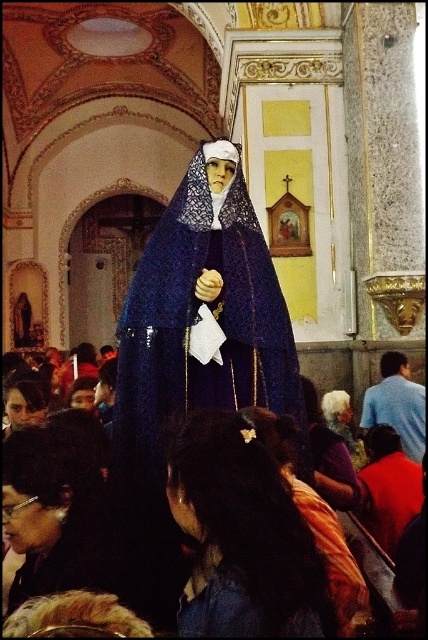
Question: Which object appears farthest from the camera in this image?

Choices:
 (A) white fabric headscarf at center
 (B) dark brown hair at center
 (C) gray hair at center
 (D) blue shirt at right

Answer: (C)

Question: Does blue shirt at right have a greater width compared to matte black hair at lower left?

Choices:
 (A) yes
 (B) no

Answer: (B)

Question: Among these points, which one is nearest to the camera?

Choices:
 (A) (419, 449)
 (B) (341, 477)
 (C) (362, 515)
 (D) (261, 570)

Answer: (D)

Question: Is white fabric headscarf at center further to the viewer compared to gray hair at center?

Choices:
 (A) no
 (B) yes

Answer: (A)

Question: Does dark brown hair at center lie behind blue shirt at right?

Choices:
 (A) yes
 (B) no

Answer: (B)

Question: Which point is closer to the camera taking this photo?

Choices:
 (A) (359, 467)
 (B) (341, 493)
 (C) (250, 580)
 (D) (422, 408)

Answer: (C)